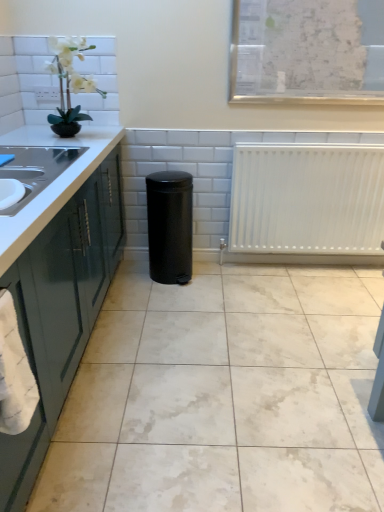
Image resolution: width=384 pixels, height=512 pixels. I want to click on free spot to the right of black matte trash can at center, so click(225, 282).